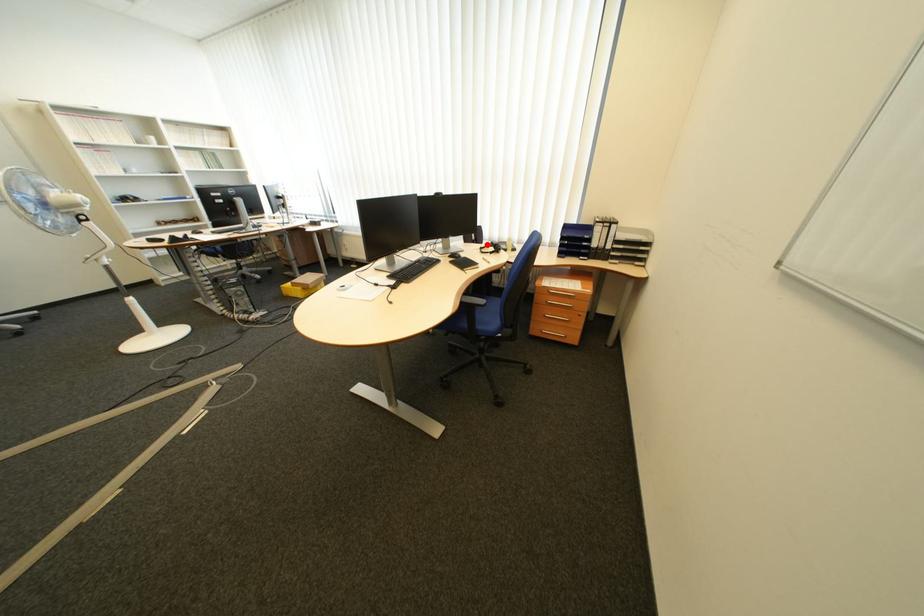
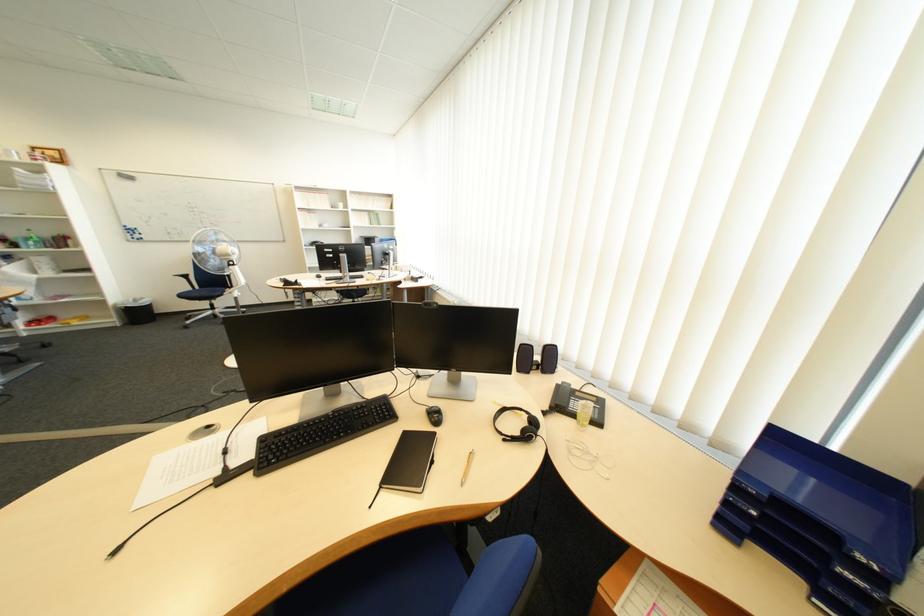
In the second image, find the point that corresponds to the highlighted location in the first image.

(551, 370)